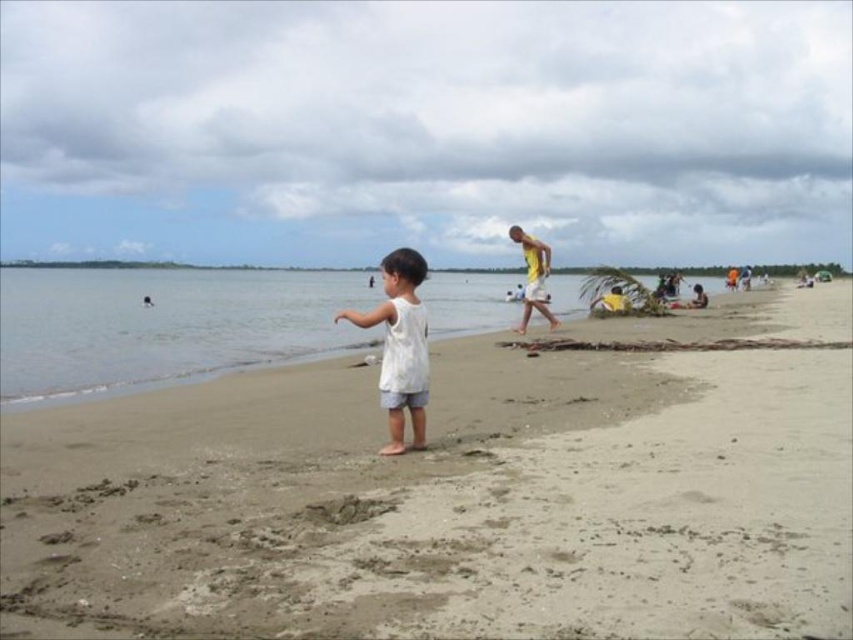
In the scene shown: The image shows a beach scene with a child and several beachgoers. There is a point marked at coordinates (442, 500). What is located at this point?

The light brown sand at center is located at point (442, 500).